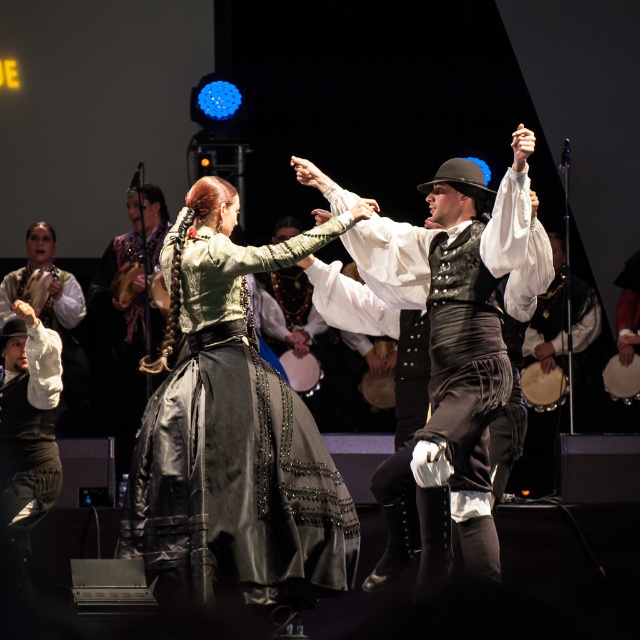
You are a stagehand preparing to move the white leather drum at right and the smooth beige drum at lower right to the storage room. If you need to place them in a space that can only accommodate the smaller drum, which drum should you prioritize moving first?

The smooth beige drum at lower right should be prioritized because it is smaller than the white leather drum at right, so it can fit into the storage space first.

You are a photographer positioned at the back of the theater. You want to capture a photo where the shiny black vest at center is clearly visible above the satin black dress at center. Is this possible based on their current positions?

The satin black dress at center is located below the shiny black vest at center, so yes, the photographer can capture the shiny black vest at center above the satin black dress at center in the photo.